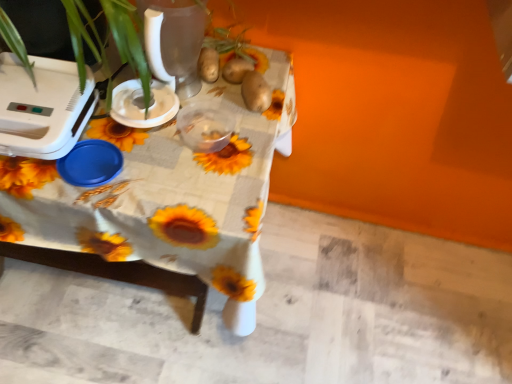
Find the location of `vacant area on top of white plastic appliance at left, the first appliance from the left (from a real-world perspective)`. vacant area on top of white plastic appliance at left, the first appliance from the left (from a real-world perspective) is located at coordinates pyautogui.click(x=32, y=85).